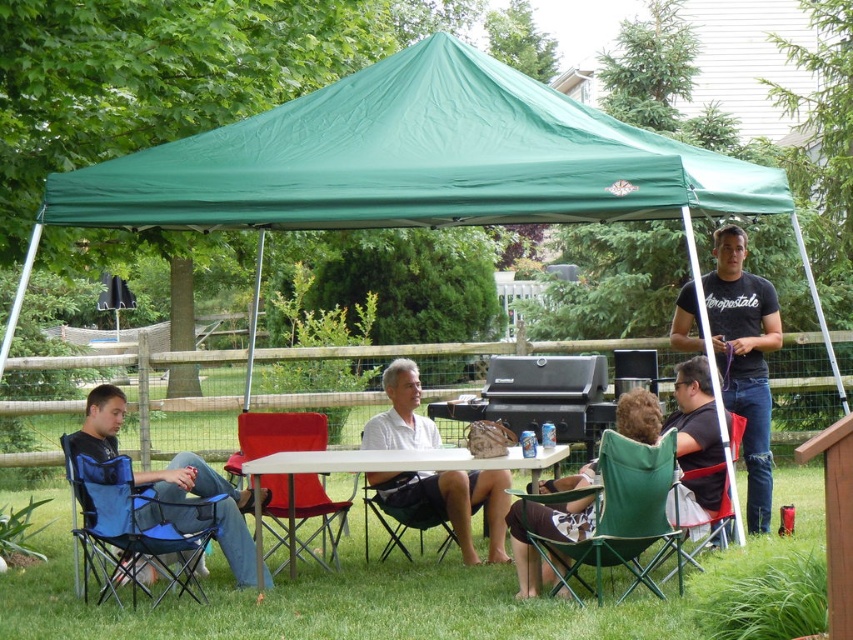
Question: Which object is closer to the camera taking this photo?

Choices:
 (A) green fabric chair at lower center
 (B) green fabric chair at lower right
 (C) white cotton shirt at center
 (D) blue fabric folding chair at lower left

Answer: (A)

Question: Is green fabric canopy at upper center further to the viewer compared to green fabric chair at lower center?

Choices:
 (A) yes
 (B) no

Answer: (B)

Question: Which of these objects is positioned closest to the white plastic table at center?

Choices:
 (A) green fabric chair at center
 (B) black t-shirt at center
 (C) matte red folding chair at center

Answer: (C)

Question: Can you confirm if black t-shirt at center is smaller than white cotton shirt at center?

Choices:
 (A) yes
 (B) no

Answer: (B)

Question: Which of the following is the closest to the observer?

Choices:
 (A) green fabric chair at lower right
 (B) green fabric folding chair at center
 (C) green fabric chair at lower center

Answer: (C)

Question: Is white plastic table at center in front of green fabric chair at center?

Choices:
 (A) yes
 (B) no

Answer: (A)